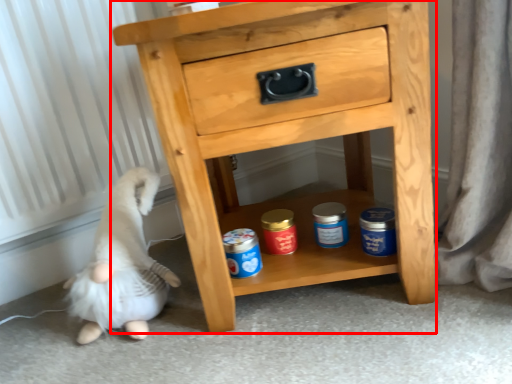
Question: Observing the image, what is the correct spatial positioning of chest of drawers (annotated by the red box) in reference to animal?

Choices:
 (A) right
 (B) left

Answer: (A)